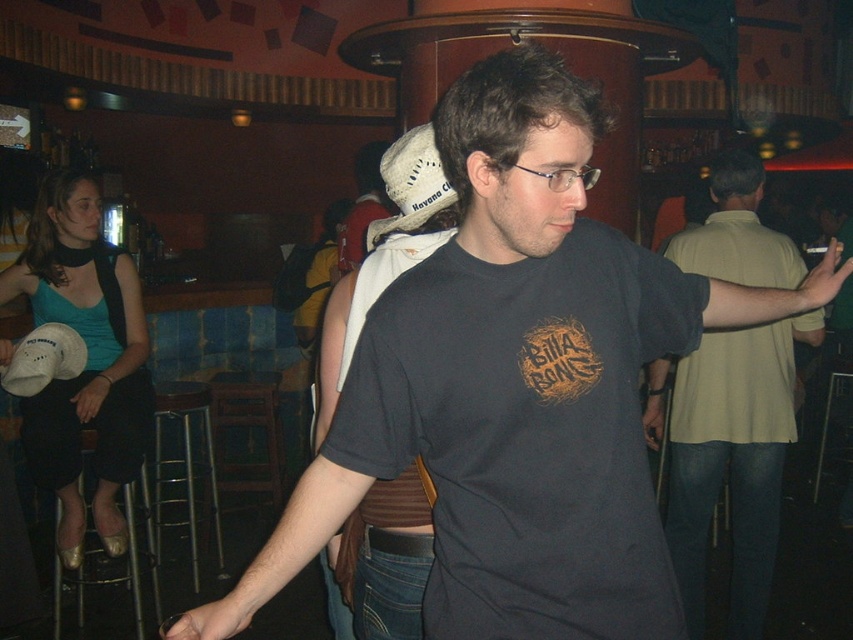
Question: Is light beige shirt at right positioned behind black matte t-shirt at center?

Choices:
 (A) no
 (B) yes

Answer: (B)

Question: Among these points, which one is nearest to the camera?

Choices:
 (A) (618, 396)
 (B) (767, 348)
 (C) (405, 580)

Answer: (A)

Question: Which point is farther to the camera?

Choices:
 (A) dark gray cotton t-shirt at center
 (B) black matte t-shirt at center
 (C) light beige shirt at right

Answer: (C)

Question: Which of these objects is positioned closest to the light beige shirt at right?

Choices:
 (A) dark gray cotton t-shirt at center
 (B) black matte t-shirt at center

Answer: (B)

Question: Does dark gray cotton t-shirt at center appear under light beige shirt at right?

Choices:
 (A) no
 (B) yes

Answer: (A)

Question: Does dark gray cotton t-shirt at center have a lesser width compared to light beige shirt at right?

Choices:
 (A) no
 (B) yes

Answer: (A)